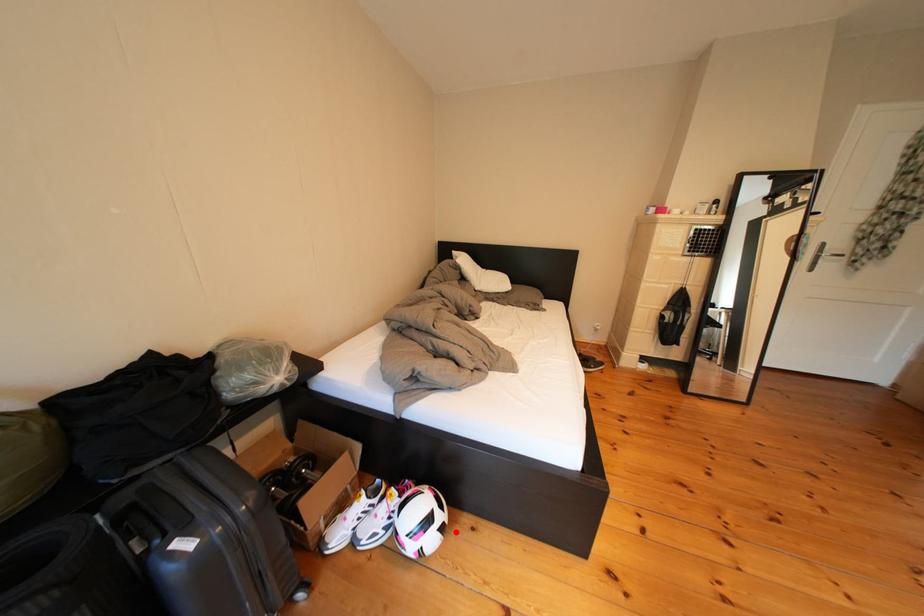
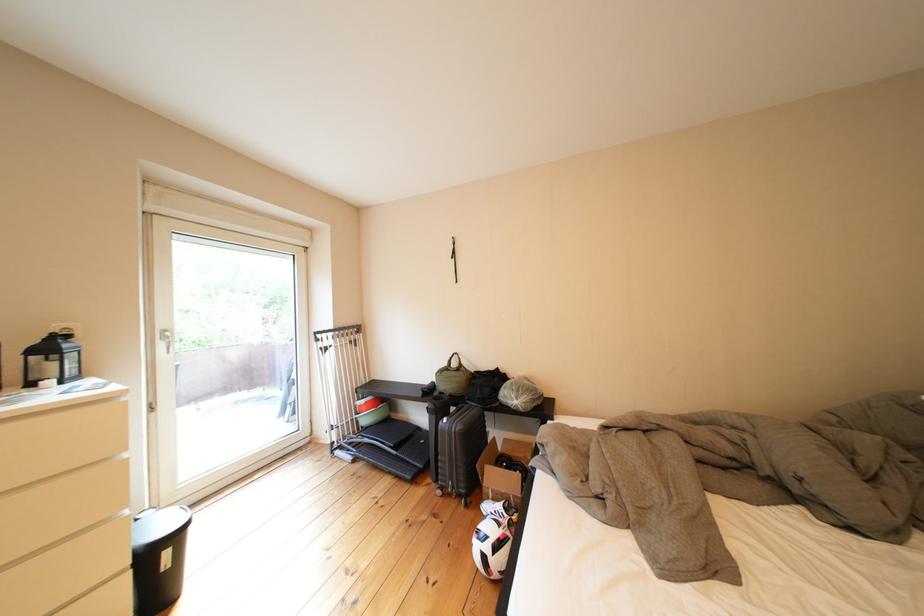
Question: I am providing you with two images of the same scene from different viewpoints. In image1, a red point is highlighted. Considering the same 3D point in image2, which of the following is correct?

Choices:
 (A) It is closer
 (B) It is farther

Answer: (B)